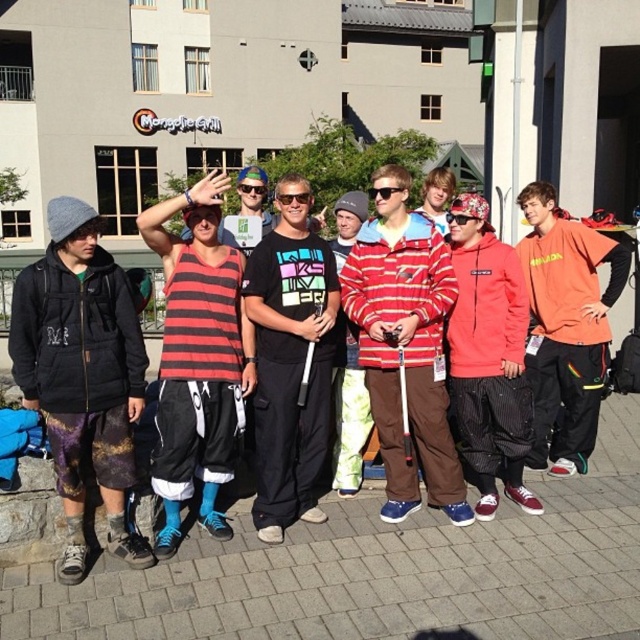
You are a photographer trying to capture a photo of the black fleece jacket at left and the red fleece hoodie at center. Based on their positions, which one would appear closer to the bottom of the photo?

The black fleece jacket at left appears closer to the bottom of the photo because it is positioned below the red fleece hoodie at center.